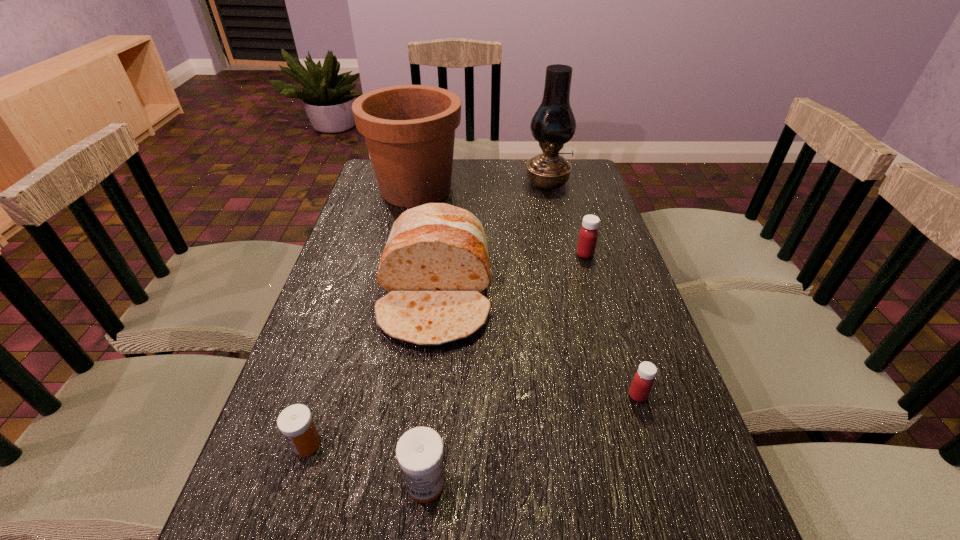
Where is `the farther white medicine`? the farther white medicine is located at coordinates (295, 422).

The height and width of the screenshot is (540, 960). In order to click on the sixth farthest object in this screenshot , I will do `click(295, 422)`.

In order to click on free space located 0.260m on the front of the oil lamp in this screenshot , I will do `click(560, 238)`.

Identify the location of vacant space situated 0.070m on the front of the flowerpot. coord(408,228).

Locate an element on the screen. The width and height of the screenshot is (960, 540). vacant space located at the sliced end of the third tallest object is located at coordinates (413, 505).

Where is `vacant space located on the back of the nearest medicine`? Image resolution: width=960 pixels, height=540 pixels. vacant space located on the back of the nearest medicine is located at coordinates (434, 388).

The image size is (960, 540). In order to click on vacant space located 0.240m on the front of the farther red medicine in this screenshot , I will do `click(605, 322)`.

Where is `blank space located 0.240m on the front of the smaller red medicine`? blank space located 0.240m on the front of the smaller red medicine is located at coordinates (681, 532).

Identify the location of free point located on the front of the sixth farthest object. Image resolution: width=960 pixels, height=540 pixels. (286, 510).

Find the location of a particular element. The image size is (960, 540). oil lamp that is at the far edge is located at coordinates (553, 124).